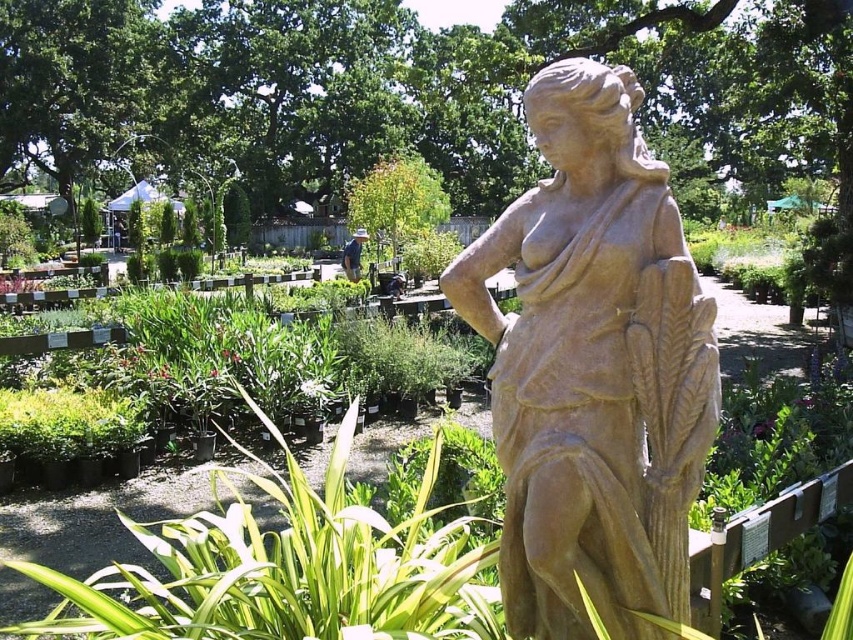
You are a gardener planning to place a new plant pot in the garden. The statue of the woman is at the center. Where would the point at coordinates (593, 369) be located in relation to the statue?

The point at coordinates (593, 369) is on the matte stone statue at center, so placing the new plant pot there would mean it is directly on the statue itself.

Consider the image. You are a gardener who wants to water the green leafy plant at center. The matte stone statue at center is blocking your path. Can you move around the statue to reach the plant?

The matte stone statue at center is positioned on the right side of green leafy plant at center, so you can move around the statue to the left side to access the plant.

You are a gardener who needs to water the green leafy plant at center and the matte stone statue at center. The watering can you have can only reach 28 inches. Can you water both objects without moving the watering can?

The matte stone statue at center is 29.06 inches from the green leafy plant at center. Since the watering can can only reach 28 inches, you cannot water both objects without moving the watering can because the distance between them exceeds the can reach.